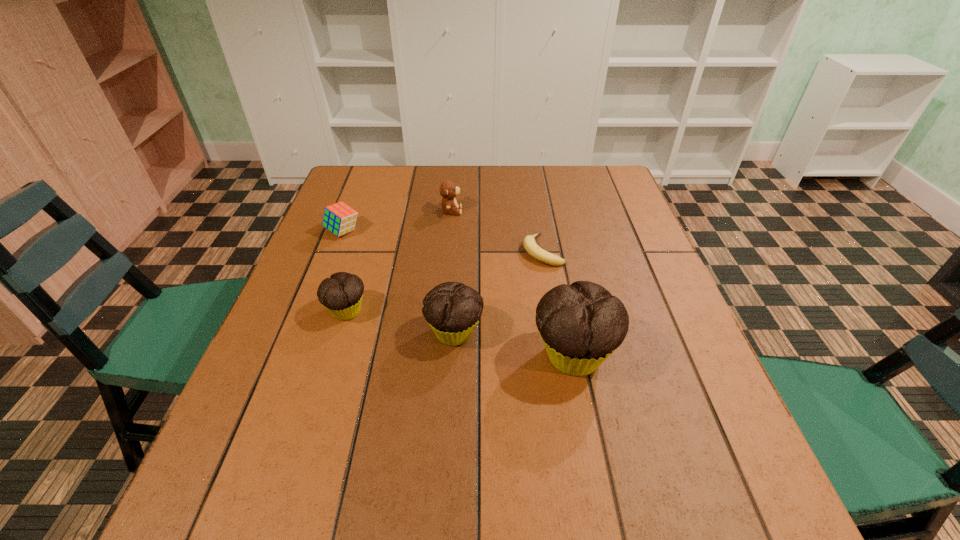
The height and width of the screenshot is (540, 960). Identify the location of free space located 0.150m on the left of the rightmost muffin. (458, 356).

Where is `free space located 0.360m on the back of the banana`? free space located 0.360m on the back of the banana is located at coordinates (529, 170).

Where is `blank space located 0.270m on the back of the cube`? blank space located 0.270m on the back of the cube is located at coordinates (365, 176).

Find the location of a particular element. The height and width of the screenshot is (540, 960). free spot located on the face of the teddy bear is located at coordinates (520, 211).

Locate an element on the screen. The width and height of the screenshot is (960, 540). object located in the far edge section of the desktop is located at coordinates (448, 190).

The width and height of the screenshot is (960, 540). I want to click on muffin situated at the left edge, so click(x=342, y=293).

Where is `cube that is at the left edge`? cube that is at the left edge is located at coordinates (339, 218).

You are a GUI agent. You are given a task and a screenshot of the screen. Output one action in this format:
    pyautogui.click(x=<x>, y=<y>)
    Task: Click on the free space at the far edge
    The image size is (960, 540).
    Given the screenshot: What is the action you would take?
    pyautogui.click(x=523, y=184)

Find the location of a particular element. Image resolution: width=960 pixels, height=540 pixels. vacant space at the near edge of the desktop is located at coordinates (396, 423).

This screenshot has width=960, height=540. Find the location of `vacant region at the left edge`. vacant region at the left edge is located at coordinates (295, 315).